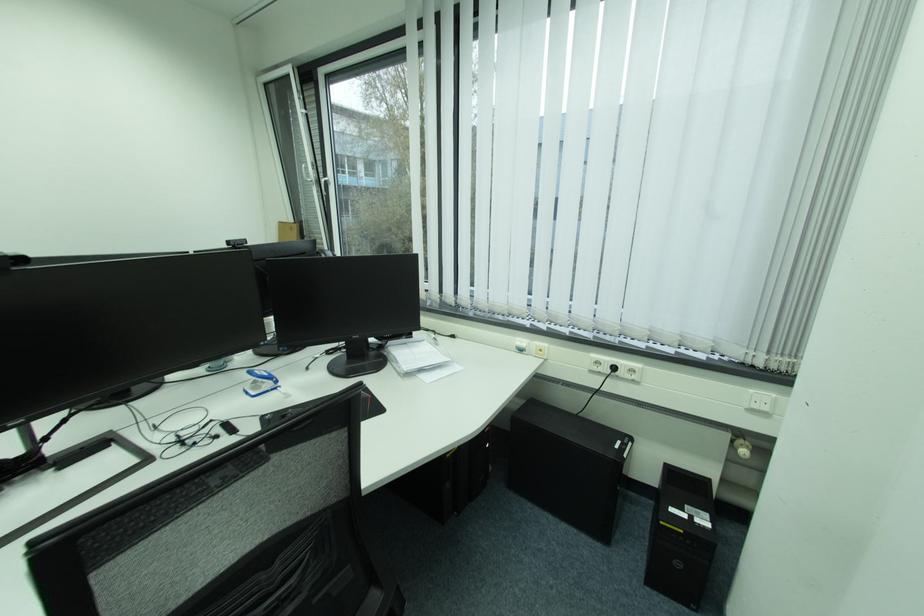
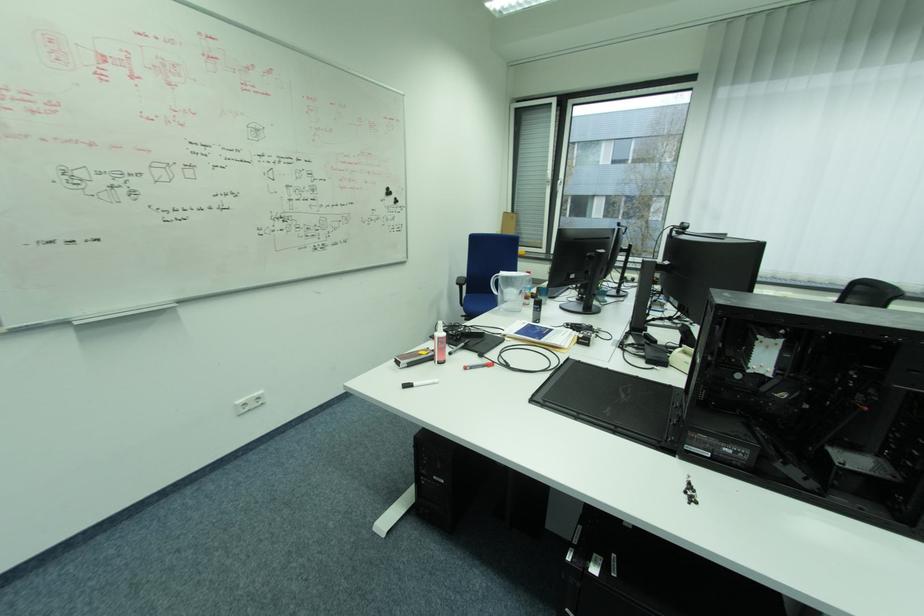
What movement of the cameraman would produce the second image?

The movement direction of the cameraman is left, backward.